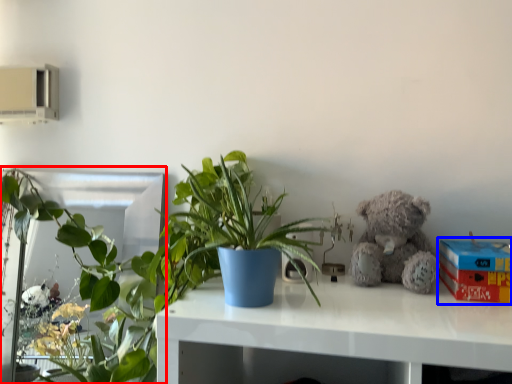
Question: Which of the following is the closest to the observer, houseplant (highlighted by a red box) or box (highlighted by a blue box)?

Choices:
 (A) houseplant
 (B) box

Answer: (B)